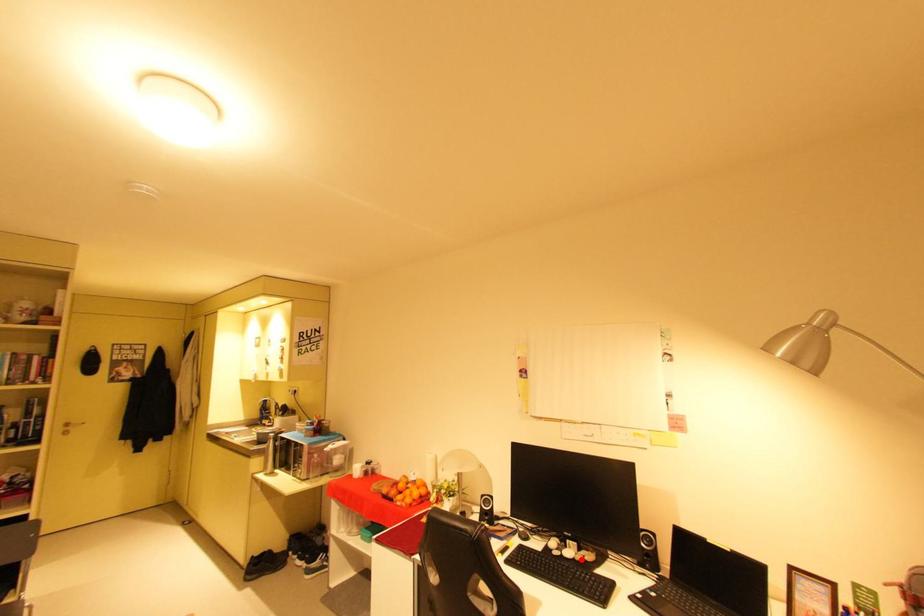
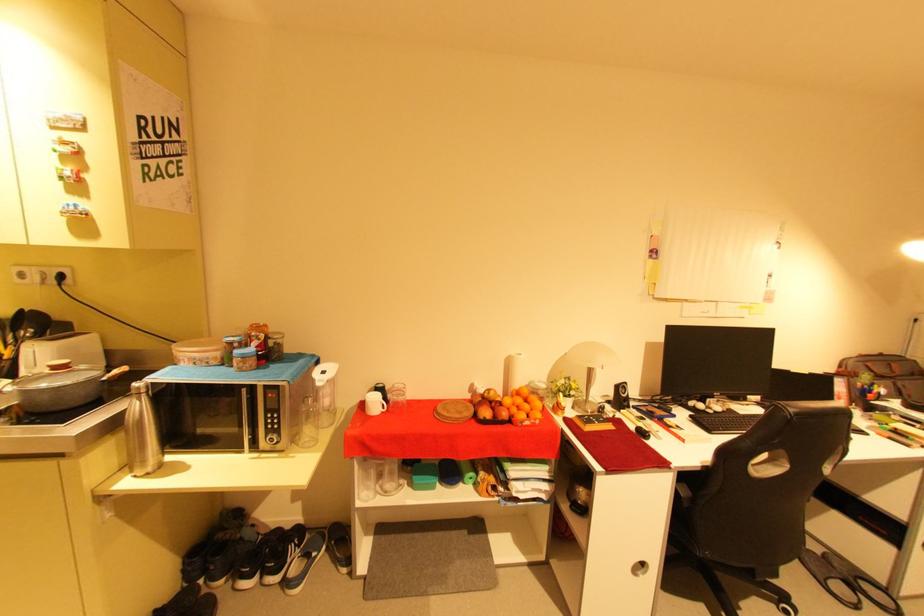
Find the pixel in the second image that matches the highlighted location in the first image.

(730, 411)